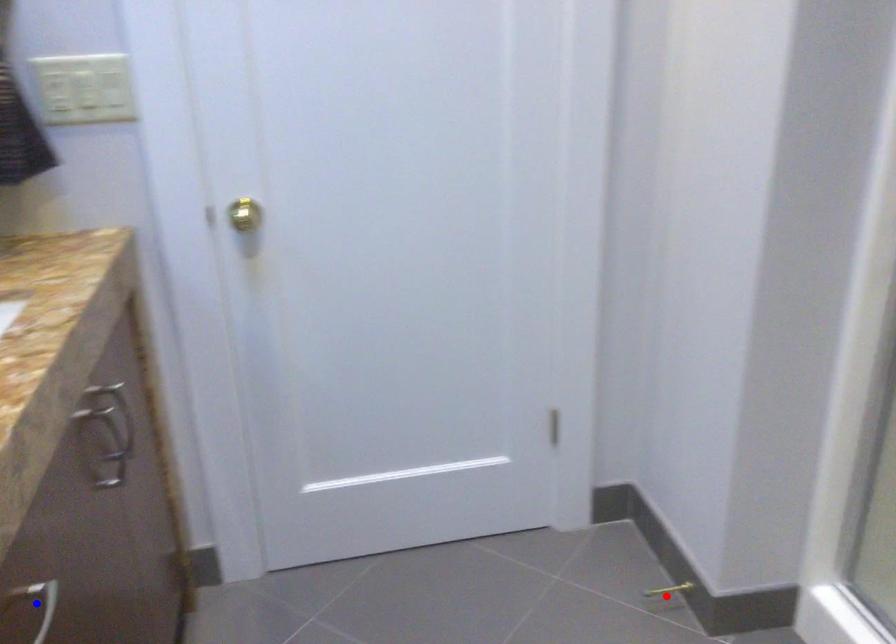
Question: In the image, two points are highlighted. Which point is nearer to the camera? Reply with the corresponding letter.

Choices:
 (A) blue point
 (B) red point

Answer: (A)